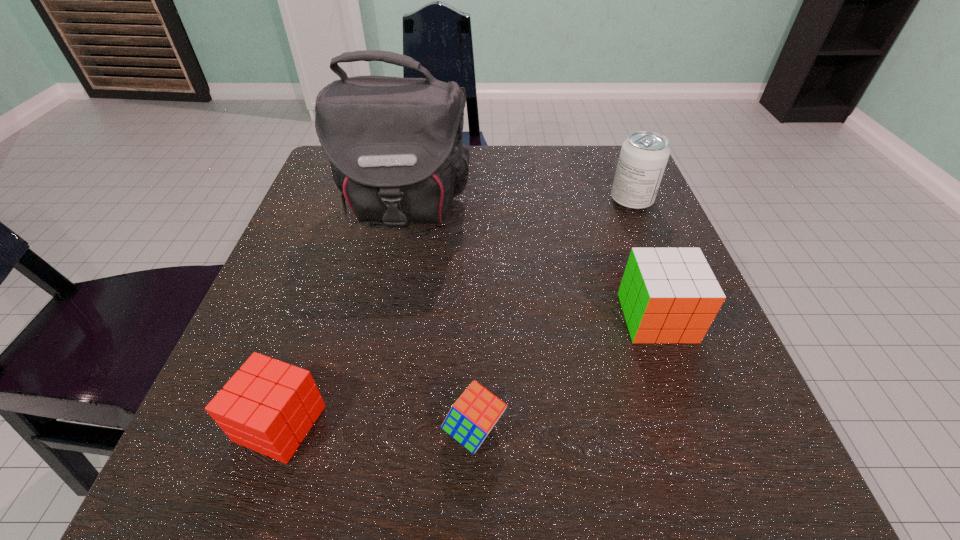
Find the location of a particular element. The height and width of the screenshot is (540, 960). object situated at the far right corner is located at coordinates (643, 158).

Image resolution: width=960 pixels, height=540 pixels. I want to click on vacant space at the far edge of the desktop, so click(x=479, y=152).

Locate an element on the screen. Image resolution: width=960 pixels, height=540 pixels. blank space at the left edge of the desktop is located at coordinates (350, 291).

In order to click on free region at the right edge of the desktop in this screenshot , I will do `click(700, 403)`.

You are a GUI agent. You are given a task and a screenshot of the screen. Output one action in this format:
    pyautogui.click(x=<x>, y=<y>)
    Task: Click on the vacant space at the near left corner of the desktop
    
    Given the screenshot: What is the action you would take?
    pyautogui.click(x=174, y=481)

In the image, there is a desktop. Where is `vacant space at the far right corner`? vacant space at the far right corner is located at coordinates (588, 171).

The image size is (960, 540). In order to click on vacant space that is in between the rightmost cube and the shoulder bag in this screenshot , I will do `click(530, 262)`.

Find the location of a particular element. This screenshot has height=540, width=960. free space between the second tallest object and the second cube from left to right is located at coordinates (553, 315).

Find the location of a particular element. free space between the tallest cube and the shortest object is located at coordinates (565, 374).

Find the location of `vacant area that lies between the tallest object and the soda can`. vacant area that lies between the tallest object and the soda can is located at coordinates (517, 204).